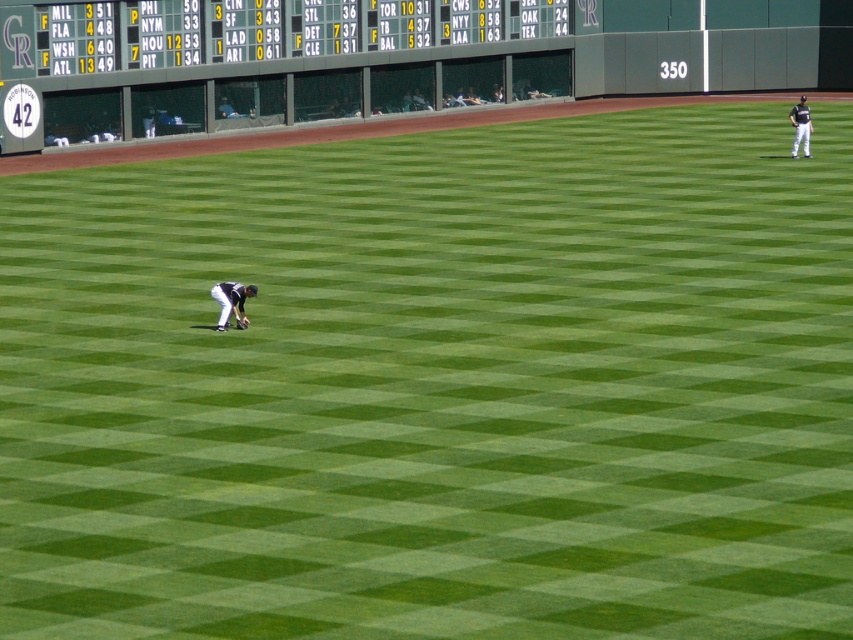
You are a photographer trying to capture a wide shot of the baseball field. You want to include both the white plastic scoreboard at upper center and the dark brown leather glove at center in your photo. However, your camera has a limited zoom range. Which object should you prioritize keeping in frame if you can only focus on one due to distance constraints?

The white plastic scoreboard at upper center is larger in size than the dark brown leather glove at center, so you should prioritize keeping the white plastic scoreboard at upper center in frame to ensure it is visible in the wide shot.

You are a photographer at the baseball field. You want to take a photo of the point at coordinates (231, 301). Where should you aim your camera to capture this point?

The point at coordinates (231, 301) is located on the black uniform at lower left, so you should aim your camera at the black uniform at lower left to capture this point.

You are a photographer trying to capture a wide shot of the baseball field. You want to include both the white plastic scoreboard at upper center and the dark brown leather glove at center in your frame. Based on their sizes, which object should you prioritize positioning closer to the camera to ensure it stands out more in the photo?

The white plastic scoreboard at upper center has a larger width than the dark brown leather glove at center, so positioning it closer to the camera will make it stand out more in the photo.